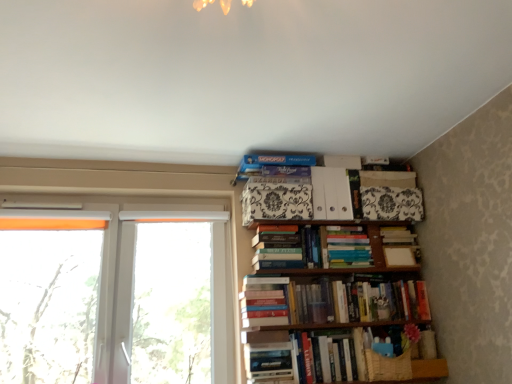
Find the location of a particular element. hardcover book at lower center, the 2th book ordered from the bottom is located at coordinates 271,363.

What do you see at coordinates (297, 355) in the screenshot?
I see `hardcover book at lower right, the seventh book positioned from the top` at bounding box center [297, 355].

How much space does hardcover book at lower right, arranged as the 3th book when ordered from the bottom, occupy horizontally?

It is 22.14 centimeters.

Where is `hardcover books at center, marked as the eighth book in a bottom-to-top arrangement`? Image resolution: width=512 pixels, height=384 pixels. hardcover books at center, marked as the eighth book in a bottom-to-top arrangement is located at coordinates (346, 247).

The image size is (512, 384). Describe the element at coordinates (270, 163) in the screenshot. I see `blue cardboard game at upper center, which appears as the 9th book when ordered from the bottom` at that location.

Image resolution: width=512 pixels, height=384 pixels. In order to click on transparent plastic window at left, arranged as the 1th window when viewed from the right in this screenshot , I will do `click(170, 301)`.

Considering the points (255, 172) and (393, 308), which point is behind, point (255, 172) or point (393, 308)?

The point (393, 308) is farther from the camera.

Which object is positioned more to the left, blue cardboard game at upper center, which appears as the 9th book when ordered from the bottom, or hardcover books at center, the sixth book viewed from the top?

blue cardboard game at upper center, which appears as the 9th book when ordered from the bottom, is more to the left.

Between blue cardboard game at upper center, acting as the first book starting from the top, and hardcover books at center, the sixth book viewed from the top, which one has more height?

With more height is hardcover books at center, the sixth book viewed from the top.

Can you tell me how much blue cardboard game at upper center, acting as the first book starting from the top, and hardcover books at center, the sixth book viewed from the top, differ in facing direction?

The facing directions of blue cardboard game at upper center, acting as the first book starting from the top, and hardcover books at center, the sixth book viewed from the top, are 0.000199 degrees apart.

Considering the points (398, 262) and (161, 307), which point is in front, point (398, 262) or point (161, 307)?

The point (161, 307) is closer.

This screenshot has width=512, height=384. Find the location of `window that is the 3rd one below the white matte paper at center, arranged as the 1th paperback book when viewed from the right (from a real-world perspective)`. window that is the 3rd one below the white matte paper at center, arranged as the 1th paperback book when viewed from the right (from a real-world perspective) is located at coordinates (170, 301).

Is white matte paper at center, arranged as the 1th paperback book when viewed from the right, beside transparent plastic window at left, arranged as the 1th window when viewed from the right?

white matte paper at center, arranged as the 1th paperback book when viewed from the right, is not next to transparent plastic window at left, arranged as the 1th window when viewed from the right, and they're not touching.

Based on the photo, in terms of height, does white matte paper at center, marked as the third paperback book in a left-to-right arrangement, look taller or shorter compared to transparent plastic window at left, arranged as the 1th window when viewed from the right?

In the image, white matte paper at center, marked as the third paperback book in a left-to-right arrangement, appears to be shorter than transparent plastic window at left, arranged as the 1th window when viewed from the right.

Between hardcover book at center, which is the 3th book from top to bottom, and white plastic window at left, arranged as the 2th window when viewed from the left, which one has larger width?

With larger width is hardcover book at center, which is the 3th book from top to bottom.

Considering the sizes of objects hardcover book at center, which is the 3th book from top to bottom, and white plastic window at left, arranged as the 2th window when viewed from the left, in the image provided, who is taller, hardcover book at center, which is the 3th book from top to bottom, or white plastic window at left, arranged as the 2th window when viewed from the left,?

Standing taller between the two is white plastic window at left, arranged as the 2th window when viewed from the left.

Would you consider hardcover book at center, which is the 3th book from top to bottom, to be distant from white plastic window at left, arranged as the 2th window when viewed from the left?

hardcover book at center, which is the 3th book from top to bottom, is actually quite close to white plastic window at left, arranged as the 2th window when viewed from the left.

Is hardcover book at center, which appears as the seventh book when ordered from the bottom, looking in the opposite direction of white plastic window at left, arranged as the 2th window when viewed from the left?

That's not correct — hardcover book at center, which appears as the seventh book when ordered from the bottom, is not looking away from white plastic window at left, arranged as the 2th window when viewed from the left.

This screenshot has height=384, width=512. What are the coordinates of `the 2nd book below the hardcover book at lower right, the seventh book positioned from the top (from the image's perspective)` in the screenshot? It's located at (330, 357).

Between hardcover book at lower right, the seventh book positioned from the top, and hardcover book at center, which is counted as the 1th book, starting from the bottom, which one appears on the left side from the viewer's perspective?

hardcover book at center, which is counted as the 1th book, starting from the bottom.

Can you confirm if hardcover book at lower right, the seventh book positioned from the top, is shorter than hardcover book at center, which is counted as the 1th book, starting from the bottom?

Yes, hardcover book at lower right, the seventh book positioned from the top, is shorter than hardcover book at center, which is counted as the 1th book, starting from the bottom.

Which is less distant, (385, 373) or (330, 359)?

Point (385, 373) is positioned closer to the camera compared to point (330, 359).

Does point (418, 361) come behind point (304, 291)?

No, it is not.

Is hardcover books at center, the sixth book viewed from the top, at the back of hardcover book at lower right, arranged as the 3th book when ordered from the bottom?

That's not correct — hardcover book at lower right, arranged as the 3th book when ordered from the bottom, is not looking away from hardcover books at center, the sixth book viewed from the top.

Which of these two, hardcover book at lower right, the seventh book positioned from the top, or hardcover books at center, which is the fourth book in bottom-to-top order, stands taller?

hardcover books at center, which is the fourth book in bottom-to-top order.

Identify the location of the 1st book above the hardcover book at lower right, arranged as the 3th book when ordered from the bottom (from the image's perspective). (x=356, y=302).

Is hardcover books at center, marked as the eighth book in a bottom-to-top arrangement, at the right side of white matte folder at upper center, which is counted as the second paperback book, starting from the left?

Yes.

Considering their positions, is hardcover books at center, marked as the eighth book in a bottom-to-top arrangement, located in front of or behind white matte folder at upper center, positioned as the 2th paperback book in right-to-left order?

hardcover books at center, marked as the eighth book in a bottom-to-top arrangement, is in front of white matte folder at upper center, positioned as the 2th paperback book in right-to-left order.

Does hardcover books at center, marked as the eighth book in a bottom-to-top arrangement, have a greater width compared to white matte folder at upper center, positioned as the 2th paperback book in right-to-left order?

In fact, hardcover books at center, marked as the eighth book in a bottom-to-top arrangement, might be narrower than white matte folder at upper center, positioned as the 2th paperback book in right-to-left order.

Considering the sizes of objects hardcover book at center, which appears as the seventh book when ordered from the bottom, and hardcover books at center, the sixth book viewed from the top, in the image provided, who is bigger, hardcover book at center, which appears as the seventh book when ordered from the bottom, or hardcover books at center, the sixth book viewed from the top,?

With larger size is hardcover books at center, the sixth book viewed from the top.

From a real-world perspective, which is physically below, hardcover book at center, which is the 3th book from top to bottom, or hardcover books at center, the sixth book viewed from the top?

hardcover books at center, the sixth book viewed from the top, is physically lower.

Considering the relative positions of hardcover book at center, which appears as the seventh book when ordered from the bottom, and hardcover books at center, the sixth book viewed from the top, in the image provided, is hardcover book at center, which appears as the seventh book when ordered from the bottom, to the left or to the right of hardcover books at center, the sixth book viewed from the top,?

Based on their positions, hardcover book at center, which appears as the seventh book when ordered from the bottom, is located to the left of hardcover books at center, the sixth book viewed from the top.

Find the location of a particular element. The height and width of the screenshot is (384, 512). the 5th book below when counting from the blue cardboard game at upper center, acting as the first book starting from the top (from the image's perspective) is located at coordinates (356, 302).

Find the location of a particular element. The width and height of the screenshot is (512, 384). window that is the 3rd object directly below the white matte paper at center, marked as the third paperback book in a left-to-right arrangement (from a real-world perspective) is located at coordinates (170, 301).

When comparing their distances from black and white patterned box at upper center, placed as the third paperback book when sorted from right to left, does hardcover book at center, which is counted as the 1th book, starting from the bottom, or white plastic window at left, arranged as the 2th window when viewed from the left, seem closer?

Among the two, hardcover book at center, which is counted as the 1th book, starting from the bottom, is located nearer to black and white patterned box at upper center, placed as the third paperback book when sorted from right to left.

From the image, which object appears to be farther from hardcover book at center, which is the 3th book from top to bottom, hardcover books at center, the 2th book viewed from the top, or white plastic window at left, acting as the 2th window starting from the right?

white plastic window at left, acting as the 2th window starting from the right.

Considering their positions, is blue cardboard game at upper center, which appears as the 9th book when ordered from the bottom, positioned further to hardcover books at center, marked as the eighth book in a bottom-to-top arrangement, than hardcover books at center, which is the fourth book in bottom-to-top order?

blue cardboard game at upper center, which appears as the 9th book when ordered from the bottom, is positioned further to the anchor hardcover books at center, marked as the eighth book in a bottom-to-top arrangement.

Looking at the image, which one is located closer to hardcover book at lower right, arranged as the 3th book when ordered from the bottom, hardcover books at center, positioned as the 5th book in bottom-to-top order, or hardcover book at lower center, the 2th book ordered from the bottom?

Based on the image, hardcover book at lower center, the 2th book ordered from the bottom, appears to be nearer to hardcover book at lower right, arranged as the 3th book when ordered from the bottom.

Which object lies further to the anchor point white matte paper at center, arranged as the 1th paperback book when viewed from the right, blue cardboard game at upper center, which appears as the 9th book when ordered from the bottom, or hardcover book at lower right, arranged as the 3th book when ordered from the bottom?

The object further to white matte paper at center, arranged as the 1th paperback book when viewed from the right, is blue cardboard game at upper center, which appears as the 9th book when ordered from the bottom.

Which object lies further to the anchor point hardcover book at center, which is counted as the 1th book, starting from the bottom, white paper at center, which is counted as the 6th book, starting from the bottom, or hardcover book at lower center, the 2th book ordered from the bottom?

white paper at center, which is counted as the 6th book, starting from the bottom.

When comparing their distances from blue cardboard game at upper center, acting as the first book starting from the top, does black and white patterned box at upper center, placed as the third paperback book when sorted from right to left, or white matte paper at center, arranged as the 1th paperback book when viewed from the right, seem further?

Among the two, white matte paper at center, arranged as the 1th paperback book when viewed from the right, is located further to blue cardboard game at upper center, acting as the first book starting from the top.

Considering their positions, is white matte paper at center, arranged as the 1th paperback book when viewed from the right, positioned closer to hardcover book at lower center, the 8th book positioned from the top, than white paper at center, which is counted as the 6th book, starting from the bottom?

white paper at center, which is counted as the 6th book, starting from the bottom, is closer to hardcover book at lower center, the 8th book positioned from the top.

Locate an element on the screen. The height and width of the screenshot is (384, 512). paperback book located between hardcover book at center, which appears as the seventh book when ordered from the bottom, and hardcover books at center, marked as the eighth book in a bottom-to-top arrangement, in the left-right direction is located at coordinates click(331, 194).

In order to click on window between white plastic window at left, arranged as the 2th window when viewed from the left, and hardcover books at center, positioned as the 5th book in bottom-to-top order, from left to right in this screenshot , I will do `click(170, 301)`.

Where is `paperback book between hardcover books at center, the 2th book viewed from the top, and hardcover book at center, which is counted as the 1th book, starting from the bottom, in the vertical direction`? The width and height of the screenshot is (512, 384). paperback book between hardcover books at center, the 2th book viewed from the top, and hardcover book at center, which is counted as the 1th book, starting from the bottom, in the vertical direction is located at coordinates (398, 256).

Locate an element on the screen. This screenshot has width=512, height=384. paperback book between black and white patterned box at upper center, placed as the third paperback book when sorted from right to left, and white matte paper at center, arranged as the 1th paperback book when viewed from the right, in the horizontal direction is located at coordinates (331, 194).